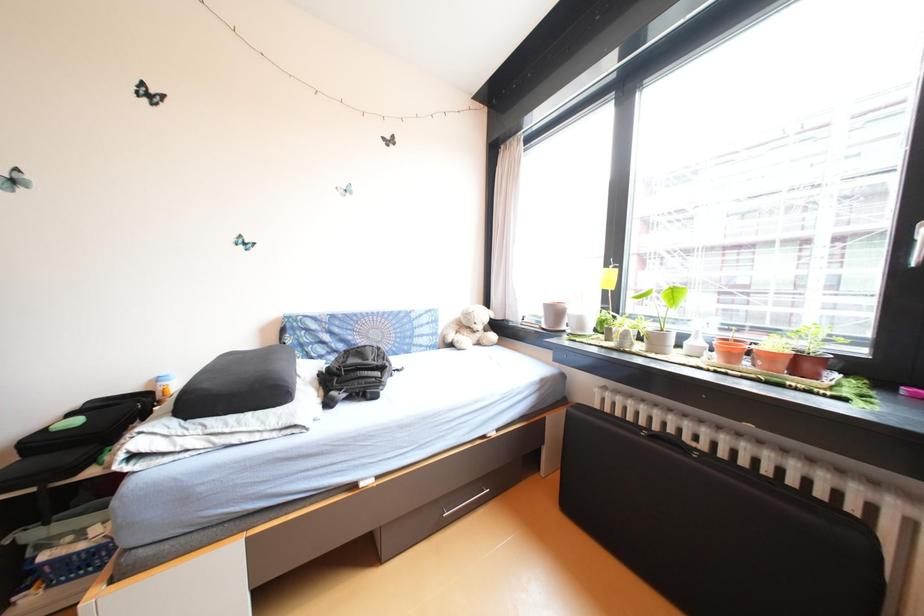
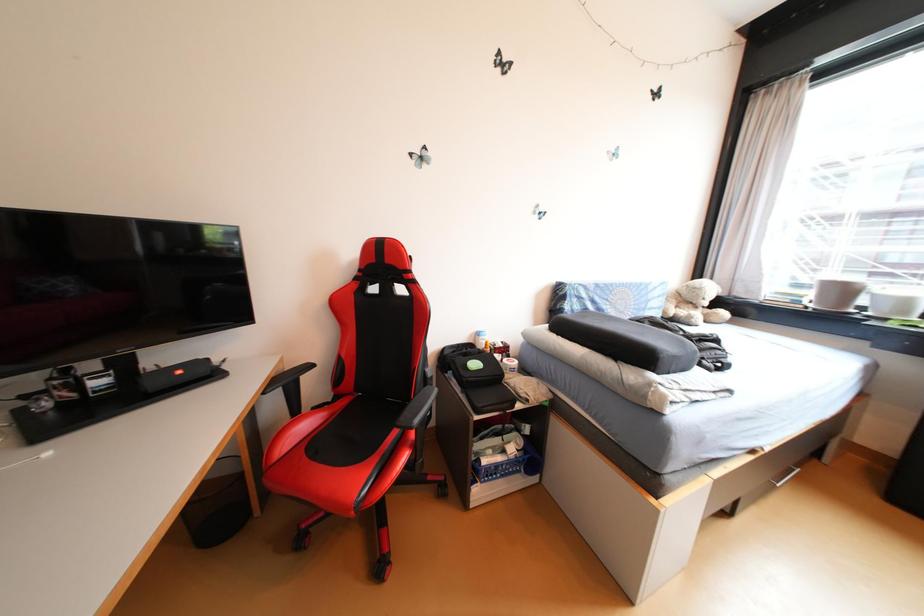
Question: What movement of the cameraman would produce the second image?

Choices:
 (A) Left
 (B) Right
 (C) Forward
 (D) Backward

Answer: (A)